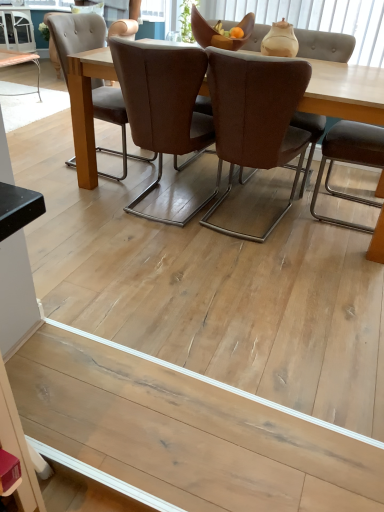
Locate an element on the screen. The image size is (384, 512). free space between brown leather chair at center, positioned as the 3th chair in right-to-left order, and brown fabric chair at center, which ranks as the 2th chair in right-to-left order is located at coordinates (x=208, y=230).